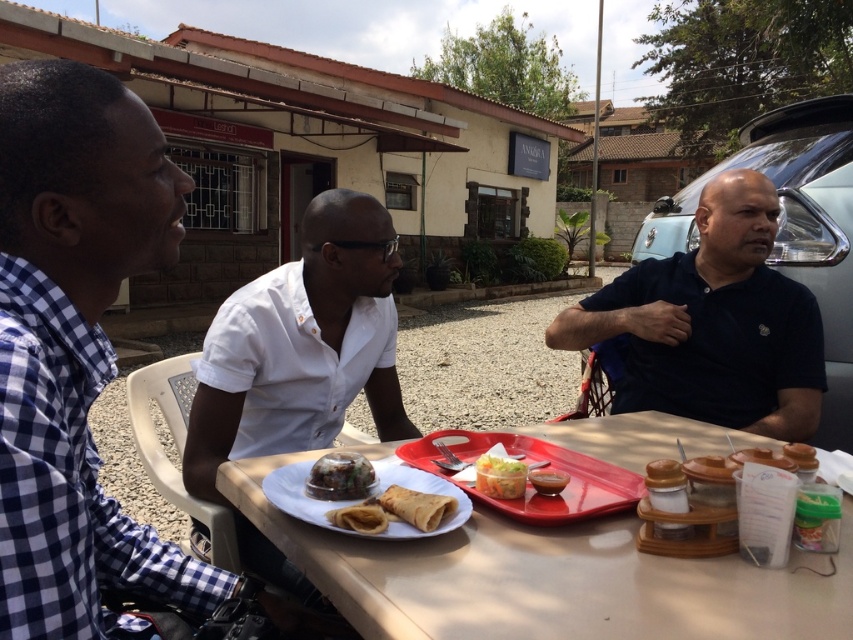
You are standing in front of the table where the three men are sitting. The man in the dark blue polo shirt at right is facing away from you. Can you see his face?

The dark blue polo shirt at right is facing away from you, so you cannot see his face.